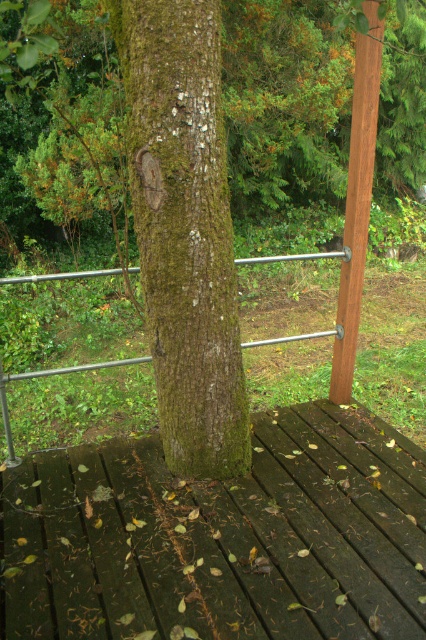
Question: Does dark brown wood at center appear on the right side of metal/rustic rail at center?

Choices:
 (A) no
 (B) yes

Answer: (A)

Question: Is dark brown wood at center positioned behind green rough bark tree trunk at center?

Choices:
 (A) yes
 (B) no

Answer: (B)

Question: Is green rough bark tree trunk at center positioned before brown wood pole at right?

Choices:
 (A) no
 (B) yes

Answer: (B)

Question: Among these objects, which one is farthest from the camera?

Choices:
 (A) dark brown wood at center
 (B) brown wood pole at right
 (C) metal/rustic rail at center
 (D) green rough bark tree trunk at center

Answer: (C)

Question: Which object appears closest to the camera in this image?

Choices:
 (A) metal/rustic rail at center
 (B) green mossy bark tree at center

Answer: (B)

Question: Among these points, which one is farthest from the camera?

Choices:
 (A) (411, 460)
 (B) (215, 291)
 (C) (264, 260)
 (D) (354, 320)

Answer: (C)